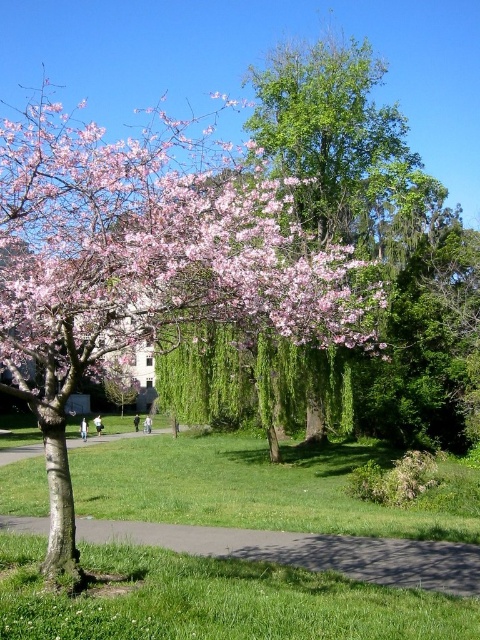
Question: Which object is closer to the camera taking this photo?

Choices:
 (A) green asphalt path at lower center
 (B) pink bloom at upper left

Answer: (B)

Question: Observing the image, what is the correct spatial positioning of green grass at lower left in reference to green asphalt path at lower center?

Choices:
 (A) left
 (B) right

Answer: (A)

Question: Which object is farther from the camera taking this photo?

Choices:
 (A) pink bloom at upper left
 (B) green asphalt path at lower center
 (C) green grass at lower left

Answer: (B)

Question: Is the position of pink bloom at upper left less distant than that of green asphalt path at lower center?

Choices:
 (A) yes
 (B) no

Answer: (A)

Question: Which object is the farthest from the green grass at lower left?

Choices:
 (A) green asphalt path at lower center
 (B) pink bloom at upper left

Answer: (B)

Question: Is pink bloom at upper left above green asphalt path at lower center?

Choices:
 (A) no
 (B) yes

Answer: (B)